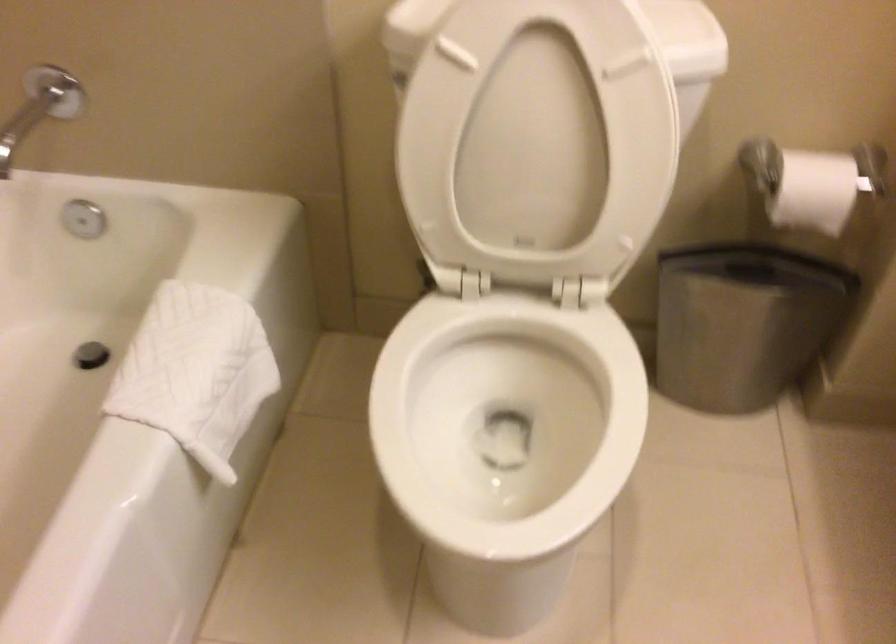
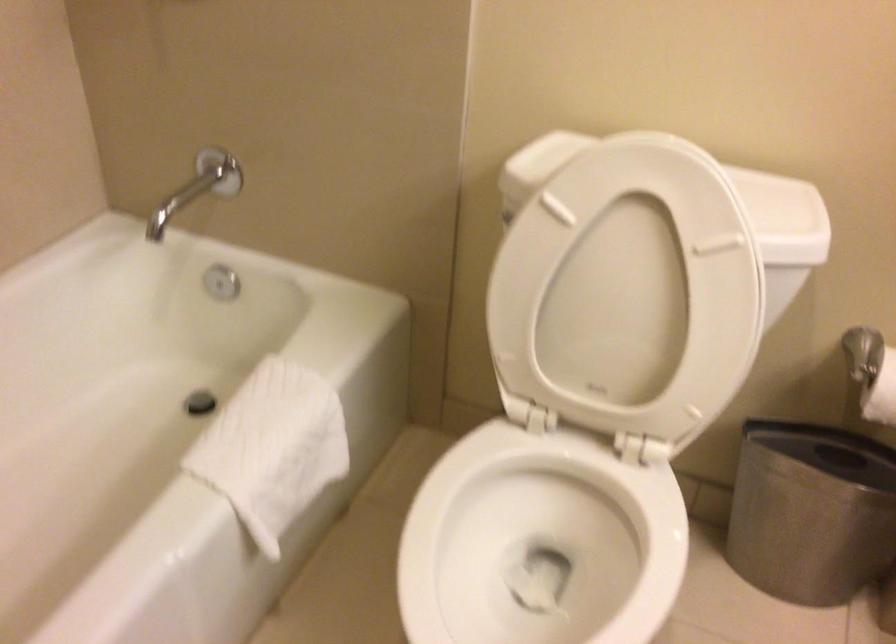
Question: Based on the continuous images, in which direction is the camera rotating? Reply with the corresponding letter.

Choices:
 (A) Left
 (B) Right
 (C) Up
 (D) Down

Answer: (A)